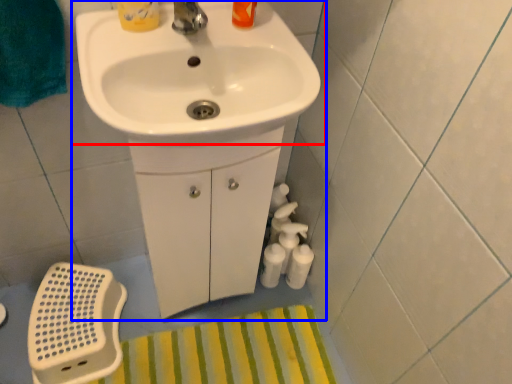
Question: Which point is closer to the camera, sink (highlighted by a red box) or sink (highlighted by a blue box)?

Choices:
 (A) sink
 (B) sink

Answer: (A)